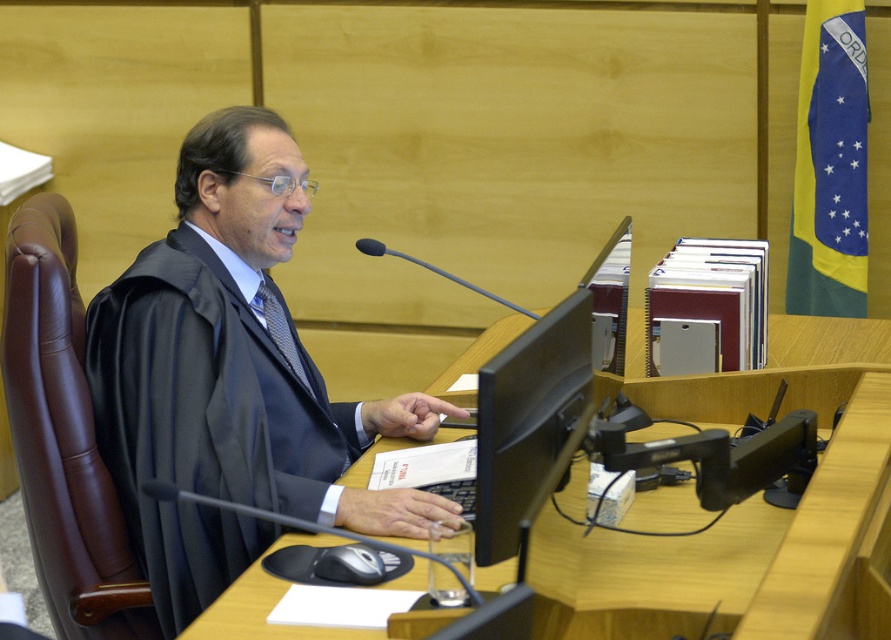
Question: Is black matte robe at center bigger than black textured tie at center?

Choices:
 (A) yes
 (B) no

Answer: (A)

Question: Which point is closer to the camera?

Choices:
 (A) black matte robe at center
 (B) wooden desk at center
 (C) black textured tie at center

Answer: (B)

Question: Estimate the real-world distances between objects in this image. Which object is closer to the wooden desk at center?

Choices:
 (A) black matte robe at center
 (B) black textured tie at center

Answer: (A)

Question: In this image, where is black matte robe at center located relative to black textured tie at center?

Choices:
 (A) below
 (B) above

Answer: (A)

Question: Does black matte robe at center appear on the left side of black textured tie at center?

Choices:
 (A) yes
 (B) no

Answer: (B)

Question: Among these points, which one is farthest from the camera?

Choices:
 (A) (298, 364)
 (B) (252, 184)

Answer: (A)